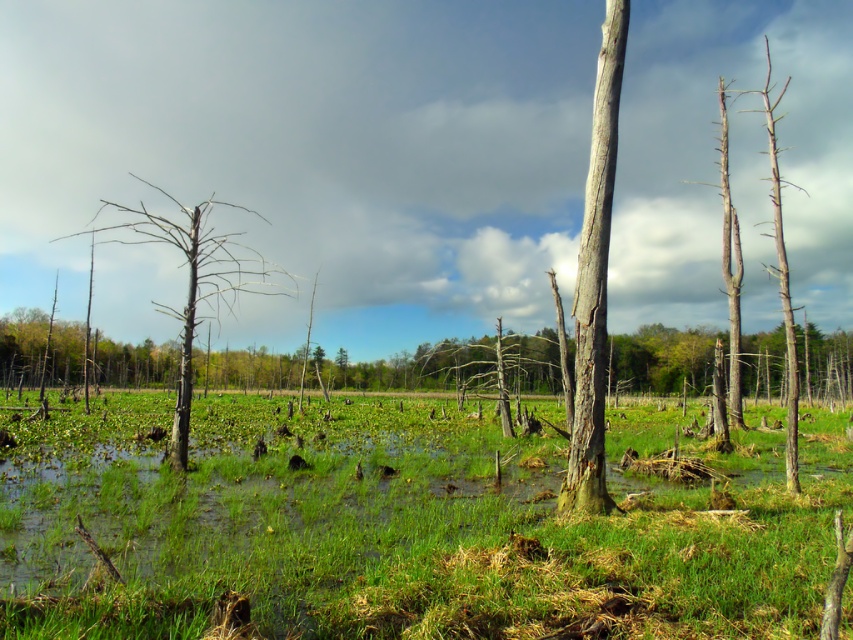
Between green grassy at center and gray bark tree at left, which one is positioned higher?

gray bark tree at left

Is green grassy at center above gray bark tree at left?

No, green grassy at center is not above gray bark tree at left.

The height and width of the screenshot is (640, 853). I want to click on green grassy at center, so click(x=398, y=536).

Based on the photo, between green grassy at center and smooth gray bark tree at center, which one is positioned lower?

green grassy at center is below.

Is point (709, 552) in front of point (599, 192)?

Yes, point (709, 552) is closer to viewer.

Is point (195, 525) positioned after point (601, 67)?

No, (195, 525) is in front of (601, 67).

The image size is (853, 640). Identify the location of green grassy at center. point(398,536).

Is smooth gray bark tree at center thinner than gray bark tree at left?

Indeed, smooth gray bark tree at center has a lesser width compared to gray bark tree at left.

Does smooth gray bark tree at center appear on the right side of gray bark tree at left?

Yes, smooth gray bark tree at center is to the right of gray bark tree at left.

Image resolution: width=853 pixels, height=640 pixels. Identify the location of smooth gray bark tree at center. (595, 280).